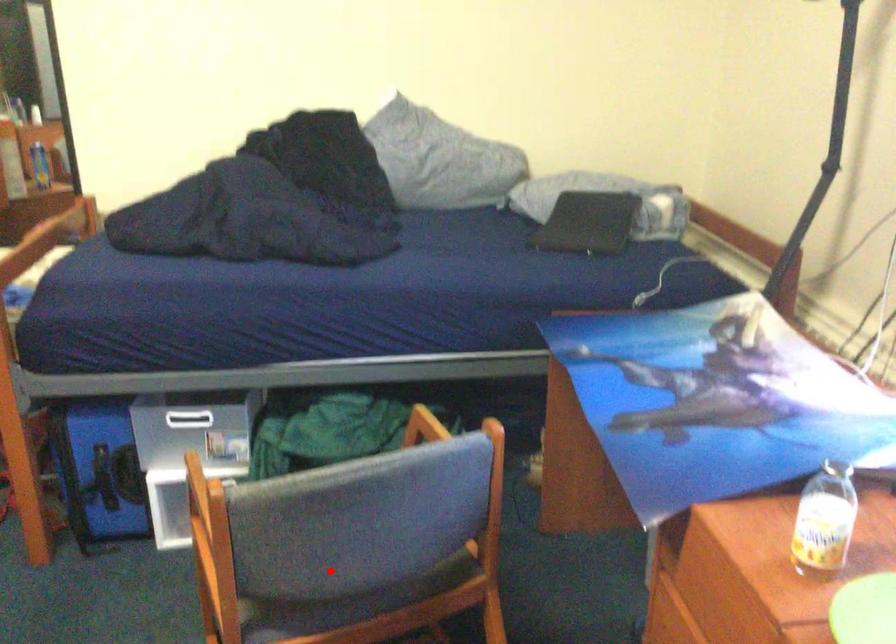
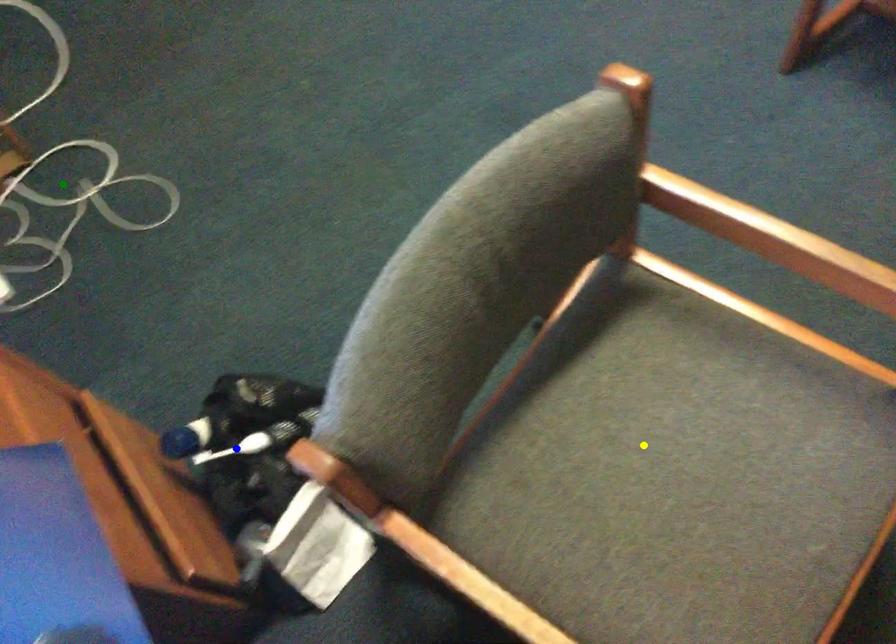
Question: I am providing you with two images of the same scene from different viewpoints. A red point is marked on the first image. You are given multiple points on the second image. Which point in image 2 represents the same 3d spot as the red point in image 1?

Choices:
 (A) green point
 (B) yellow point
 (C) blue point

Answer: (B)